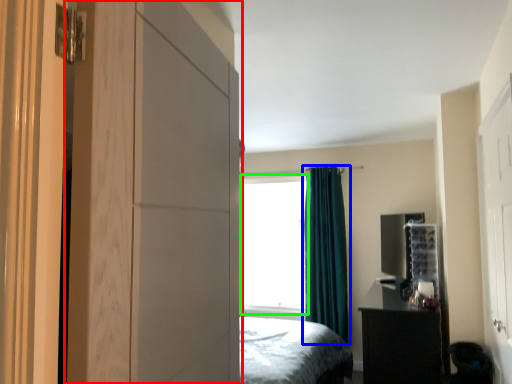
Question: Which is nearer to the dresser (highlighted by a red box)? curtain (highlighted by a blue box) or window screen (highlighted by a green box).

Choices:
 (A) curtain
 (B) window screen

Answer: (A)